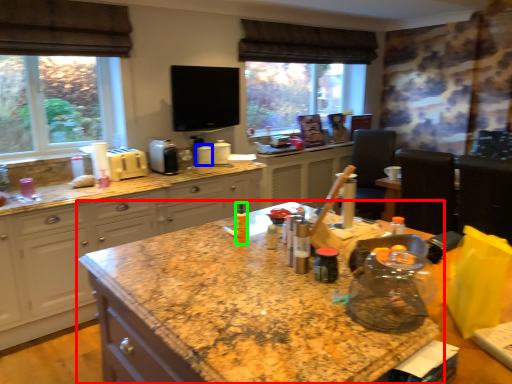
Question: Based on their relative distances, which object is nearer to countertop (highlighted by a red box)? Choose from appliance (highlighted by a blue box) and bottle (highlighted by a green box).

Choices:
 (A) appliance
 (B) bottle

Answer: (B)